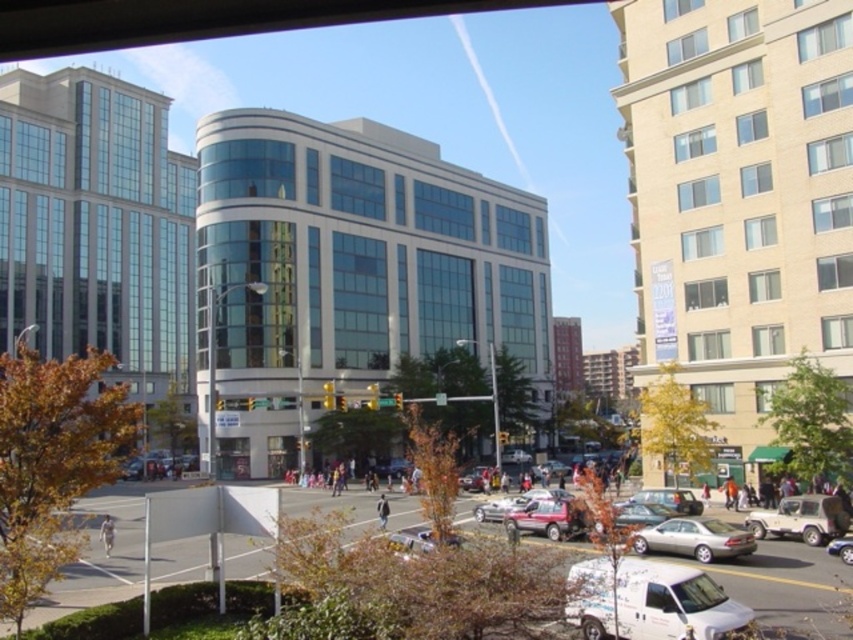
Between silver metallic sedan at lower right and light brown leather jacket at lower left, which one appears on the left side from the viewer's perspective?

From the viewer's perspective, light brown leather jacket at lower left appears more on the left side.

Can you confirm if silver metallic sedan at lower right is bigger than light brown leather jacket at lower left?

Incorrect, silver metallic sedan at lower right is not larger than light brown leather jacket at lower left.

Is point (718, 534) farther from camera compared to point (111, 528)?

No, (718, 534) is in front of (111, 528).

At what (x,y) coordinates should I click in order to perform the action: click on silver metallic sedan at lower right. Please return your answer as a coordinate pair (x, y). Looking at the image, I should click on (694, 538).

Can you confirm if silver metallic sedan at lower right is shorter than metallic silver car at center?

Indeed, silver metallic sedan at lower right has a lesser height compared to metallic silver car at center.

At what (x,y) coordinates should I click in order to perform the action: click on silver metallic sedan at lower right. Please return your answer as a coordinate pair (x, y). The image size is (853, 640). Looking at the image, I should click on (694, 538).

What do you see at coordinates (694, 538) in the screenshot? I see `silver metallic sedan at lower right` at bounding box center [694, 538].

What are the coordinates of `silver metallic sedan at lower right` in the screenshot? It's located at (694, 538).

Can you confirm if white matte van at lower center is positioned above dark blue jeans at center?

Indeed, white matte van at lower center is positioned over dark blue jeans at center.

The height and width of the screenshot is (640, 853). Describe the element at coordinates (672, 602) in the screenshot. I see `white matte van at lower center` at that location.

Is point (701, 593) less distant than point (384, 502)?

Yes, it is.

Where is `white matte van at lower center`? Image resolution: width=853 pixels, height=640 pixels. white matte van at lower center is located at coordinates (672, 602).